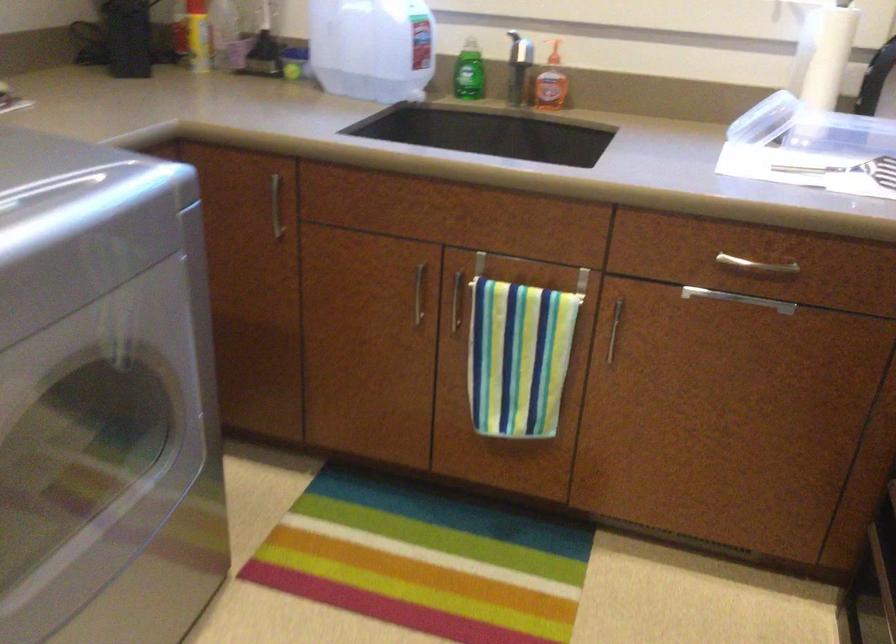
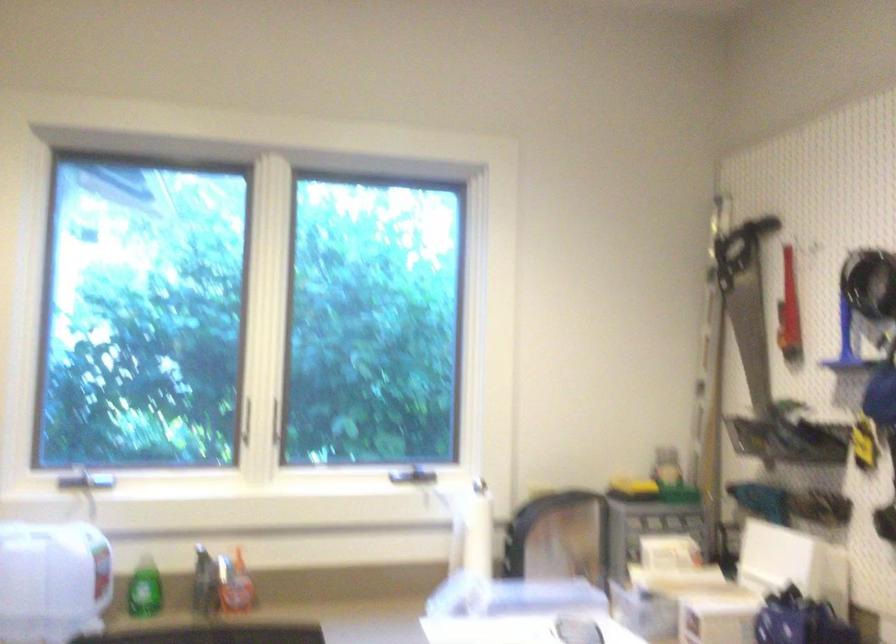
Locate, in the second image, the point that corresponds to point (519, 73) in the first image.

(204, 583)